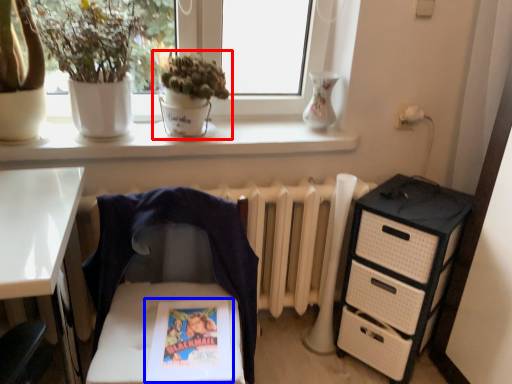
Question: Which of the following is the farthest to the observer, houseplant (highlighted by a red box) or comic book (highlighted by a blue box)?

Choices:
 (A) houseplant
 (B) comic book

Answer: (A)